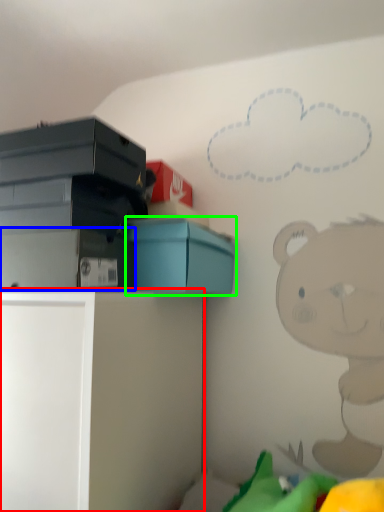
Question: Based on their relative distances, which object is farther from furniture (highlighted by a red box)? Choose from storage box (highlighted by a blue box) and box (highlighted by a green box).

Choices:
 (A) storage box
 (B) box

Answer: (B)